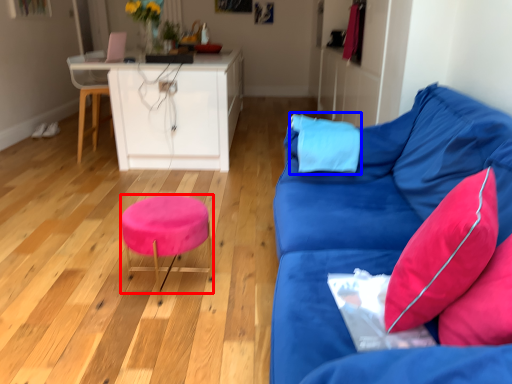
Question: Which object is closer to the camera taking this photo, stool (highlighted by a red box) or pillow (highlighted by a blue box)?

Choices:
 (A) stool
 (B) pillow

Answer: (A)